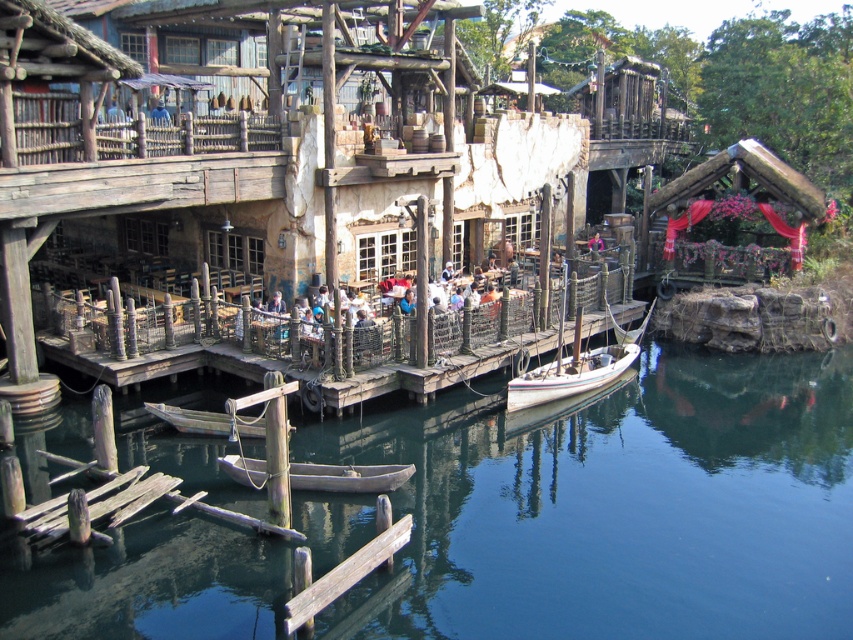
Question: Considering the real-world distances, which object is farthest from the white wooden boat at center?

Choices:
 (A) rusty wood boat at center
 (B) smooth dark blue water at center
 (C) wooden planks at center
 (D) wooden boat at center

Answer: (A)

Question: Estimate the real-world distances between objects in this image. Which object is closer to the wooden boat at center?

Choices:
 (A) smooth dark blue water at center
 (B) rusty wood boat at center
 (C) wooden planks at center
 (D) white wooden boat at center

Answer: (B)

Question: Can you confirm if wooden boat at center is positioned to the right of rusty wood boat at center?

Choices:
 (A) yes
 (B) no

Answer: (A)

Question: Among these points, which one is nearest to the camera?

Choices:
 (A) (22, 620)
 (B) (157, 410)

Answer: (A)

Question: Does wooden boat at center lie in front of rusty wood boat at center?

Choices:
 (A) no
 (B) yes

Answer: (B)

Question: Does wooden planks at center appear on the left side of white wooden boat at center?

Choices:
 (A) no
 (B) yes

Answer: (B)